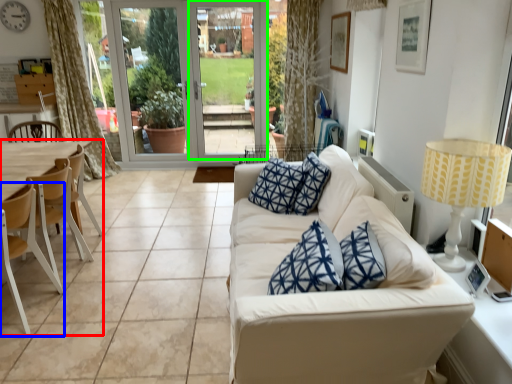
Question: Which object is the farthest from armchair (highlighted by a red box)? Choose among these: chair (highlighted by a blue box) or screen door (highlighted by a green box).

Choices:
 (A) chair
 (B) screen door

Answer: (B)